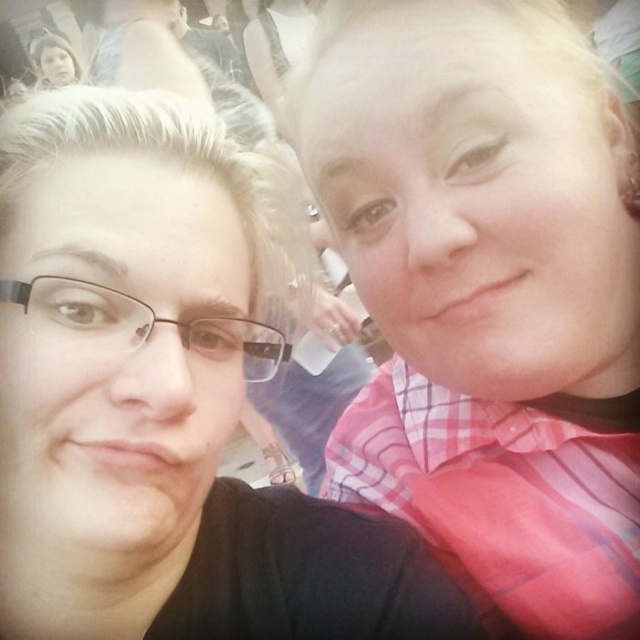
Is point (376, 442) positioned after point (352, 548)?

Yes.

The width and height of the screenshot is (640, 640). What do you see at coordinates (486, 292) in the screenshot? I see `pink checkered shirt at center` at bounding box center [486, 292].

I want to click on pink checkered shirt at center, so click(486, 292).

Does pink checkered shirt at center have a greater height compared to black plastic glasses at left?

Correct, pink checkered shirt at center is much taller as black plastic glasses at left.

Can you confirm if pink checkered shirt at center is smaller than black plastic glasses at left?

Incorrect, pink checkered shirt at center is not smaller in size than black plastic glasses at left.

Find the location of a particular element. pink checkered shirt at center is located at coordinates (486, 292).

Between pink checkered shirt at upper right and black plastic glasses at left, which one is positioned higher?

Positioned higher is black plastic glasses at left.

Is pink checkered shirt at upper right further to camera compared to black plastic glasses at left?

That is False.

Which is behind, point (26, 308) or point (72, 292)?

Positioned behind is point (72, 292).

The width and height of the screenshot is (640, 640). Identify the location of pink checkered shirt at upper right. (161, 401).